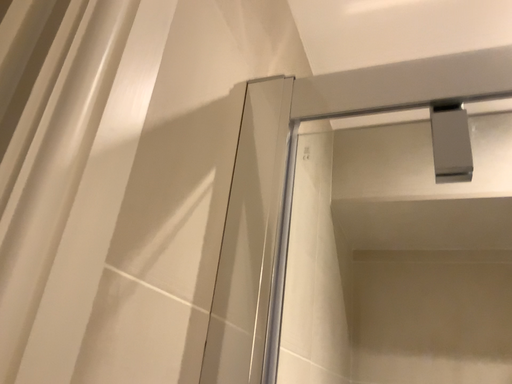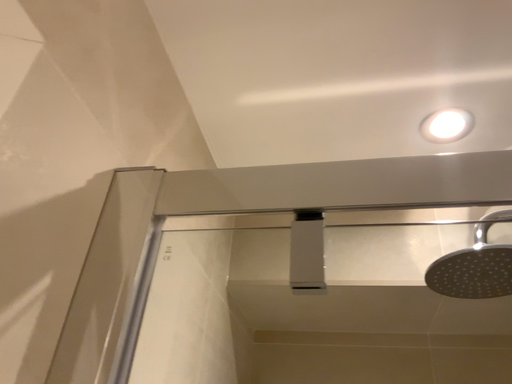
Question: How did the camera likely rotate when shooting the video?

Choices:
 (A) rotated left
 (B) rotated right

Answer: (B)